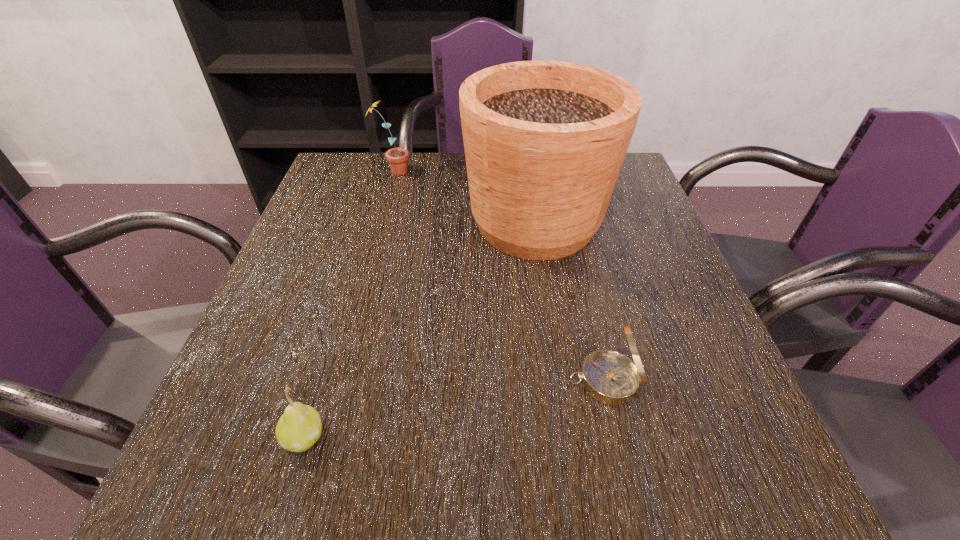
Locate an element on the screen. The height and width of the screenshot is (540, 960). vacant space that satisfies the following two spatial constraints: 1. on the back side of the nearest object; 2. on the right side of the flowerpot is located at coordinates pyautogui.click(x=369, y=222).

Where is `free location that satisfies the following two spatial constraints: 1. on the flower of the tallest object; 2. on the left side of the third shortest object`? The height and width of the screenshot is (540, 960). free location that satisfies the following two spatial constraints: 1. on the flower of the tallest object; 2. on the left side of the third shortest object is located at coordinates 379,222.

Locate an element on the screen. free space that satisfies the following two spatial constraints: 1. on the flower of the flowerpot; 2. on the right side of the sunflower is located at coordinates (379, 222).

Locate an element on the screen. This screenshot has width=960, height=540. free space that satisfies the following two spatial constraints: 1. with the dial facing the second nearest object; 2. on the front side of the nearest object is located at coordinates (618, 436).

The height and width of the screenshot is (540, 960). I want to click on vacant position in the image that satisfies the following two spatial constraints: 1. on the back side of the nearest object; 2. on the right side of the third nearest object, so click(369, 222).